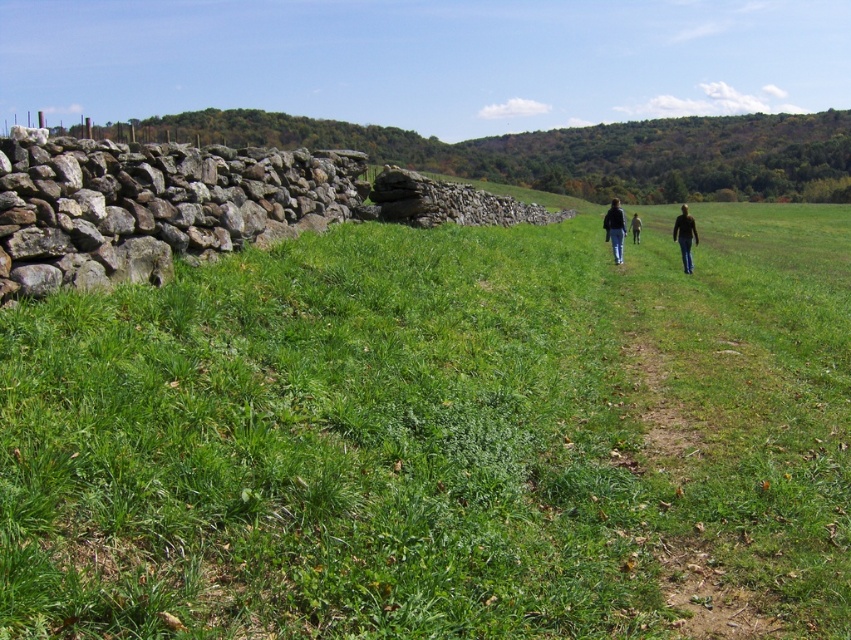
You are standing at the center of the dirt path in the rural landscape. You see the dark blue jeans at center. Where exactly is the dark blue jeans located in relation to the dirt path and the stone wall on the left?

The dark blue jeans at center is located at point 0.358 along the horizontal axis and 0.724 along the vertical axis, which places it near the lower middle part of the image. Since the dirt path runs through the center of the field and the stone wall is on the left, the jeans are positioned centrally along the path, closer to the bottom of the image and away from the stone wall.